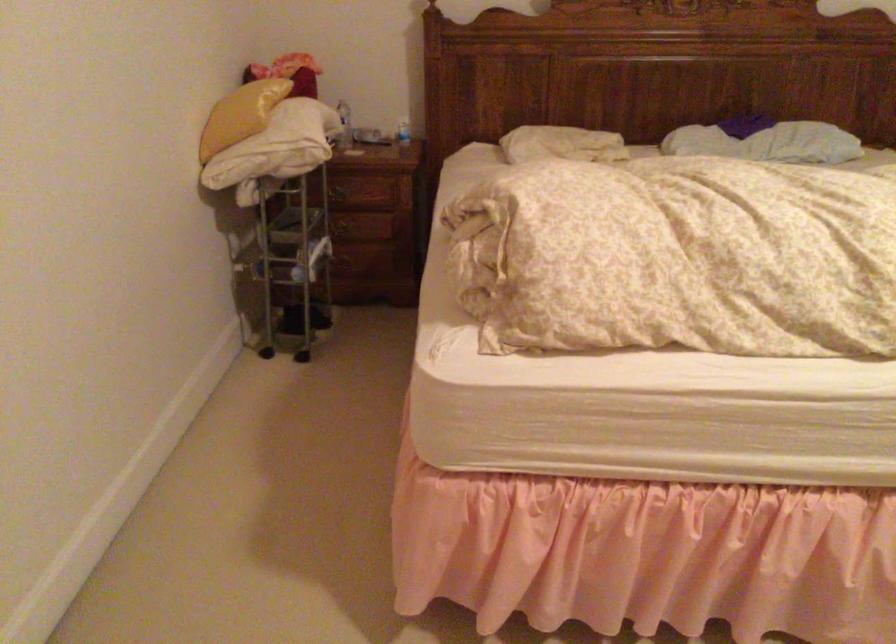
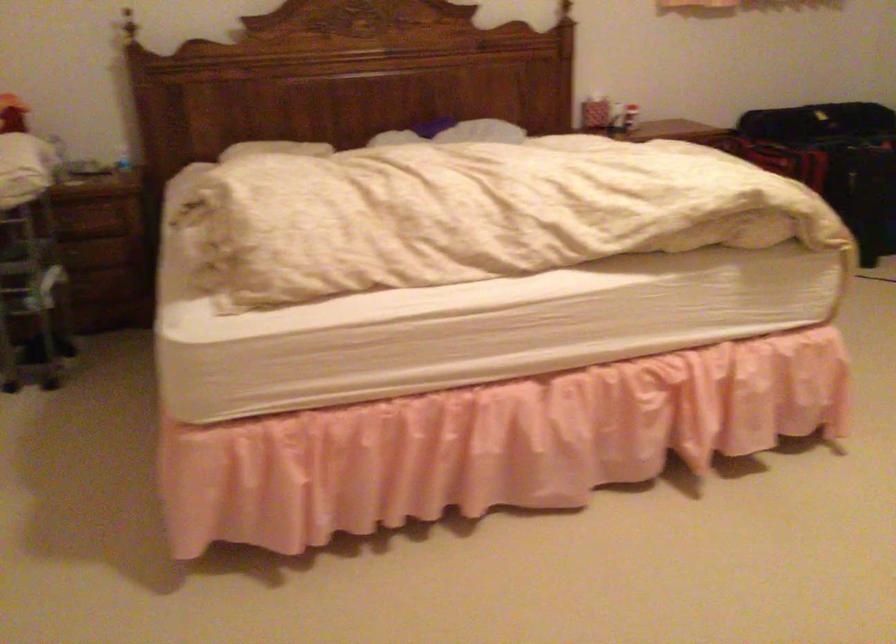
Question: The camera is either moving clockwise (left) or counter-clockwise (right) around the object. The first image is from the beginning of the video and the second image is from the end. Is the camera moving left or right when shooting the video?

Choices:
 (A) Left
 (B) Right

Answer: (A)